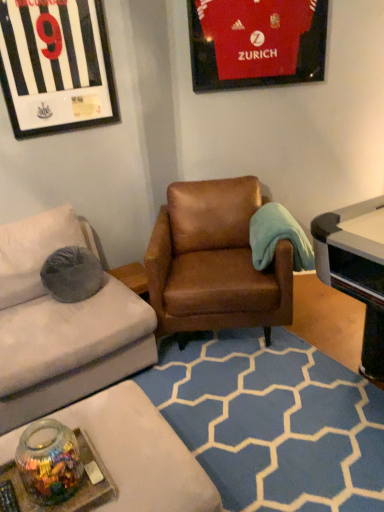
Question: Is matte red jersey at upper right, the second picture frame from the left, wider or thinner than brown leather armchair at center?

Choices:
 (A) wide
 (B) thin

Answer: (B)

Question: In the image, is matte red jersey at upper right, arranged as the 1th picture frame when viewed from the right, positioned in front of or behind brown leather armchair at center?

Choices:
 (A) front
 (B) behind

Answer: (B)

Question: Which object is the farthest from the black glossy jersey at upper left, which ranks as the first picture frame in left-to-right order?

Choices:
 (A) matte red jersey at upper right, arranged as the 1th picture frame when viewed from the right
 (B) black plastic remote control at lower left
 (C) transparent glass jar at lower left
 (D) brown leather armchair at center

Answer: (B)

Question: Which object is positioned farthest from the black plastic remote control at lower left?

Choices:
 (A) black glossy jersey at upper left, which ranks as the first picture frame in left-to-right order
 (B) brown leather armchair at center
 (C) matte red jersey at upper right, arranged as the 1th picture frame when viewed from the right
 (D) transparent glass jar at lower left

Answer: (C)